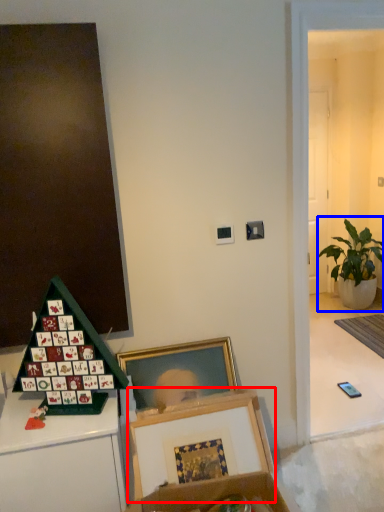
Question: Among these objects, which one is nearest to the camera, picture frame (highlighted by a red box) or houseplant (highlighted by a blue box)?

Choices:
 (A) picture frame
 (B) houseplant

Answer: (A)